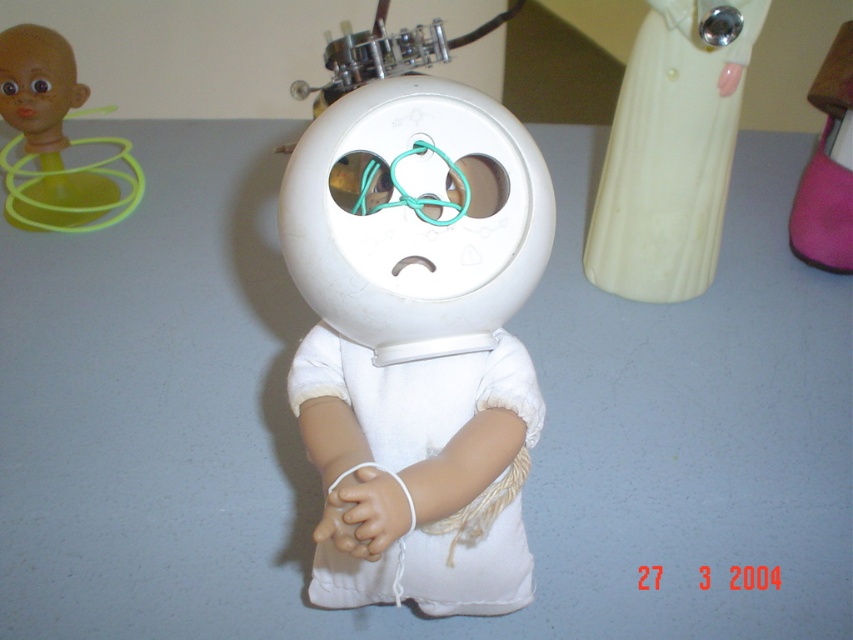
Question: Where is white matte robot at center located in relation to white glossy dress at upper right in the image?

Choices:
 (A) below
 (B) above

Answer: (A)

Question: Can you confirm if white glossy dress at upper right is positioned to the left of pink fabric doll at right?

Choices:
 (A) yes
 (B) no

Answer: (A)

Question: Which point is farther to the camera?

Choices:
 (A) pink fabric doll at right
 (B) white matte robot at center
 (C) white cotton dress at center

Answer: (A)

Question: Is white matte robot at center in front of white glossy dress at upper right?

Choices:
 (A) no
 (B) yes

Answer: (B)

Question: Among these points, which one is farthest from the camera?

Choices:
 (A) (699, 93)
 (B) (90, 200)

Answer: (B)

Question: Which of the following is the farthest from the observer?

Choices:
 (A) pink fabric doll at right
 (B) white cotton dress at center
 (C) matte yellow plastic toy at upper left

Answer: (C)